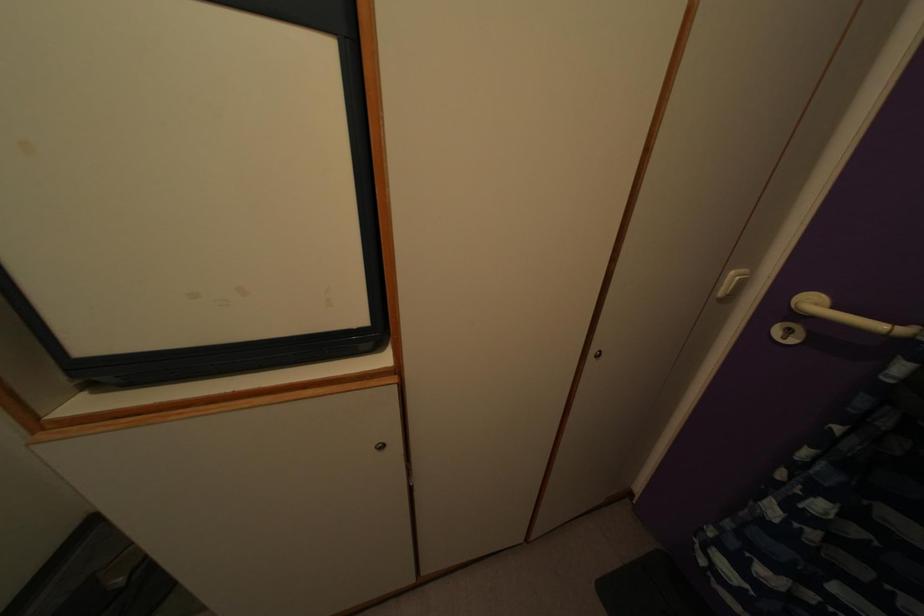
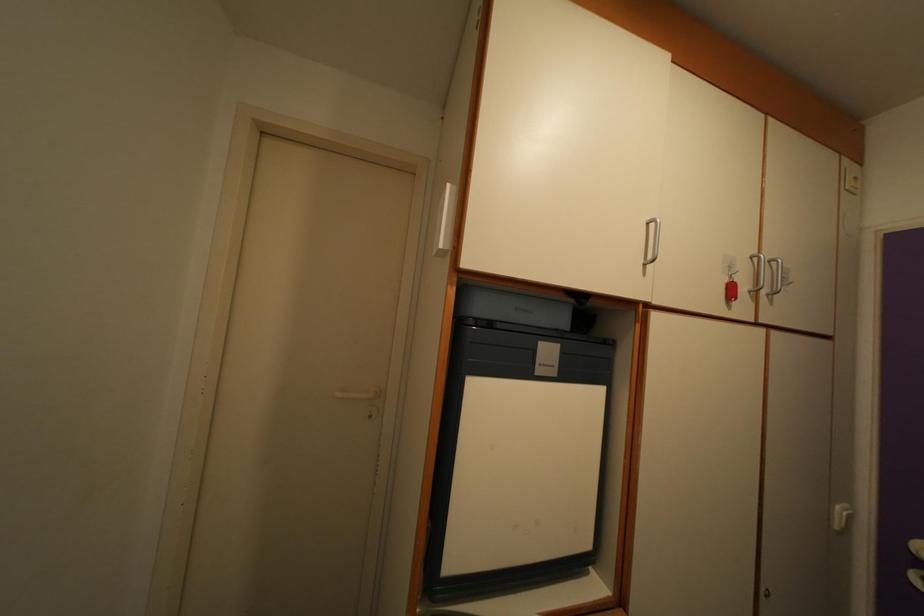
Question: The images are taken continuously from a first-person perspective. In which direction is your viewpoint rotating?

Choices:
 (A) Left
 (B) Right
 (C) Up
 (D) Down

Answer: (C)